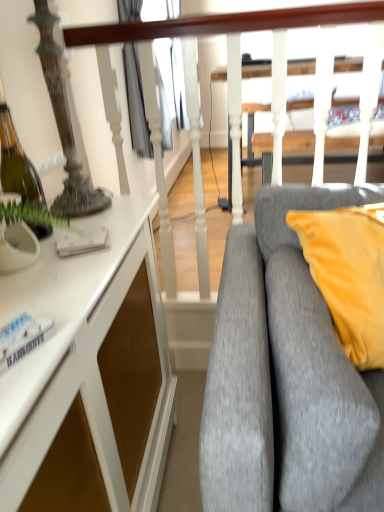
Question: Would you consider gray fabric couch at right to be distant from white textured rail at upper center?

Choices:
 (A) no
 (B) yes

Answer: (A)

Question: From the image's perspective, would you say gray fabric couch at right is shown under white textured rail at upper center?

Choices:
 (A) no
 (B) yes

Answer: (B)

Question: Is gray fabric couch at right further to camera compared to white textured rail at upper center?

Choices:
 (A) no
 (B) yes

Answer: (A)

Question: Can you confirm if gray fabric couch at right is positioned to the left of white textured rail at upper center?

Choices:
 (A) no
 (B) yes

Answer: (A)

Question: Could white textured rail at upper center be considered to be inside gray fabric couch at right?

Choices:
 (A) no
 (B) yes

Answer: (A)

Question: Is gray fabric couch at right at the right side of white textured rail at upper center?

Choices:
 (A) no
 (B) yes

Answer: (B)

Question: Does white glossy cabinet at left have a greater width compared to gray fabric couch at right?

Choices:
 (A) yes
 (B) no

Answer: (B)

Question: Is white glossy cabinet at left to the right of gray fabric couch at right from the viewer's perspective?

Choices:
 (A) no
 (B) yes

Answer: (A)

Question: From the image's perspective, is white glossy cabinet at left on gray fabric couch at right?

Choices:
 (A) no
 (B) yes

Answer: (A)

Question: From the image's perspective, is white glossy cabinet at left under gray fabric couch at right?

Choices:
 (A) no
 (B) yes

Answer: (B)

Question: Is white glossy cabinet at left bigger than gray fabric couch at right?

Choices:
 (A) yes
 (B) no

Answer: (A)

Question: Does white glossy cabinet at left have a smaller size compared to gray fabric couch at right?

Choices:
 (A) no
 (B) yes

Answer: (A)

Question: Does white textured rail at upper center have a lesser height compared to white glossy cabinet at left?

Choices:
 (A) no
 (B) yes

Answer: (A)